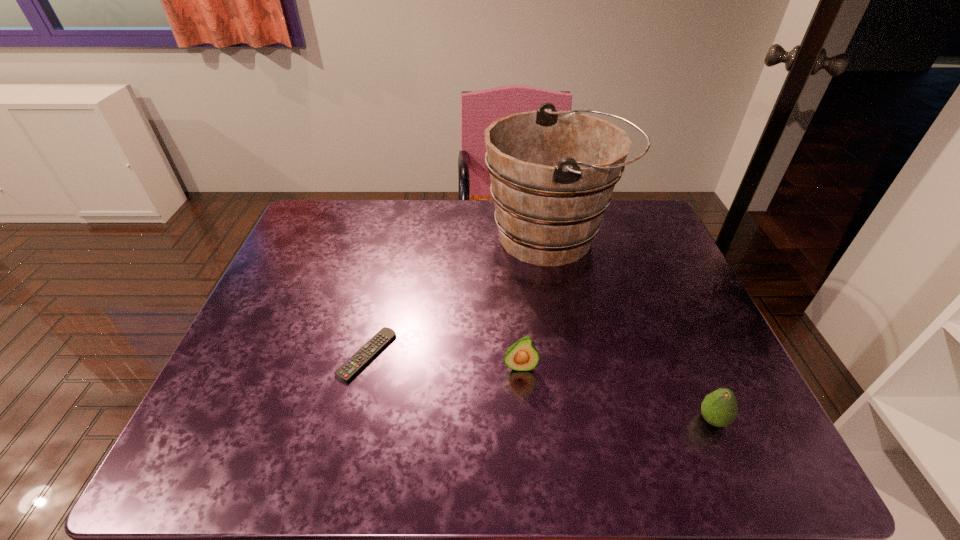
In the image, there is a desktop. In order to click on vacant area at the right edge in this screenshot , I will do `click(703, 345)`.

At what (x,y) coordinates should I click in order to perform the action: click on free region at the far left corner of the desktop. Please return your answer as a coordinate pair (x, y). The image size is (960, 540). Looking at the image, I should click on (319, 212).

Locate an element on the screen. This screenshot has height=540, width=960. vacant region between the farther avocado and the bucket is located at coordinates (537, 302).

Identify the location of vacant point located between the remote control and the tallest object. The image size is (960, 540). coord(460,296).

Locate an element on the screen. empty location between the rightmost object and the farthest object is located at coordinates 633,329.

Where is `vacant area that lies between the nearest object and the shortest object`? vacant area that lies between the nearest object and the shortest object is located at coordinates (540, 387).

This screenshot has width=960, height=540. I want to click on unoccupied area between the nearest object and the shortest object, so click(540, 387).

In order to click on empty location between the rightmost object and the leftmost object in this screenshot , I will do `click(540, 387)`.

Find the location of a particular element. This screenshot has height=540, width=960. vacant area between the shortest object and the left avocado is located at coordinates (444, 361).

Where is `unoccupied position between the remote control and the nearest object`? This screenshot has width=960, height=540. unoccupied position between the remote control and the nearest object is located at coordinates (540, 387).